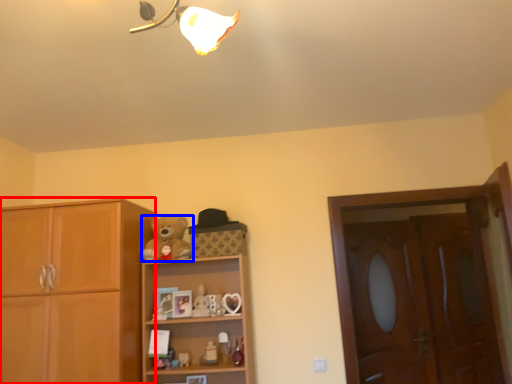
Question: Which object appears closest to the camera in this image, cabinetry (highlighted by a red box) or teddy bear (highlighted by a blue box)?

Choices:
 (A) cabinetry
 (B) teddy bear

Answer: (A)